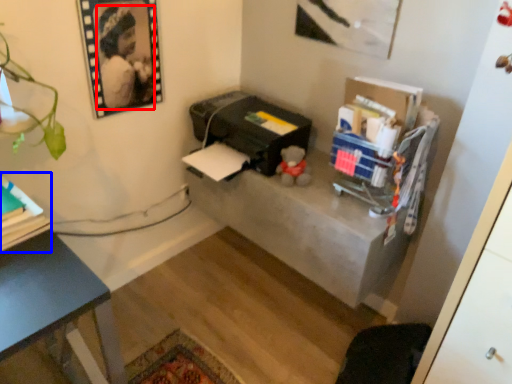
Question: Which object appears farthest to the camera in this image, person (highlighted by a red box) or book (highlighted by a blue box)?

Choices:
 (A) person
 (B) book

Answer: (A)